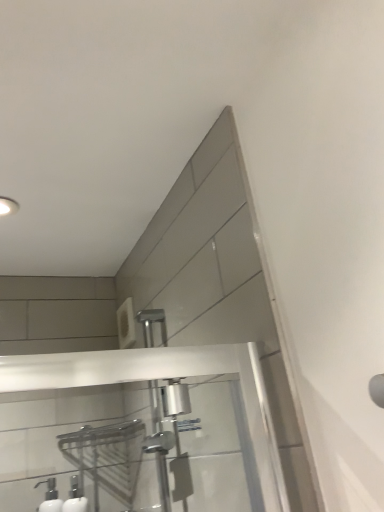
The image size is (384, 512). What are the coordinates of `brushed metal faucet at lower left` in the screenshot? It's located at (50, 497).

In order to face brushed metal faucet at lower left, should I rotate leftwards or rightwards?

To align with it, rotate left about 18.026°.

Describe the element at coordinates (50, 497) in the screenshot. Image resolution: width=384 pixels, height=512 pixels. I see `brushed metal faucet at lower left` at that location.

Where is `brushed metal faucet at lower left`? Image resolution: width=384 pixels, height=512 pixels. brushed metal faucet at lower left is located at coordinates point(50,497).